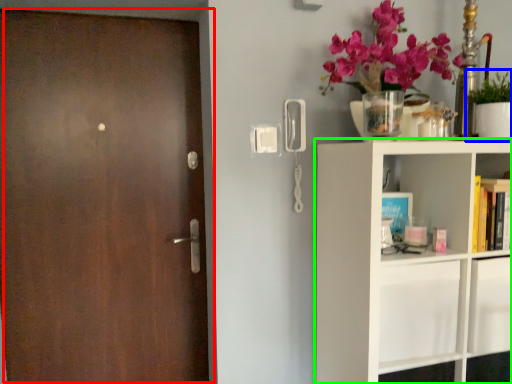
Question: Which object is positioned farthest from door (highlighted by a red box)? Select from houseplant (highlighted by a blue box) and shelf (highlighted by a green box).

Choices:
 (A) houseplant
 (B) shelf

Answer: (A)